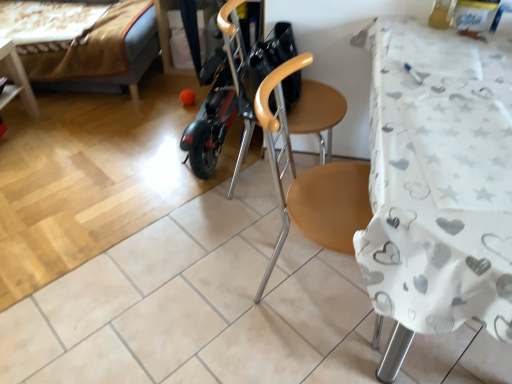
The height and width of the screenshot is (384, 512). What do you see at coordinates (310, 180) in the screenshot?
I see `wooden chair at center` at bounding box center [310, 180].

Locate an element on the screen. The image size is (512, 384). wooden swivel chair at center is located at coordinates (280, 83).

Find the location of a particular element. This screenshot has height=384, width=512. velvet brown bed at upper left is located at coordinates (102, 54).

In the scene shown: Does wooden chair at center have a greater width compared to wooden swivel chair at center?

Incorrect, the width of wooden chair at center does not surpass that of wooden swivel chair at center.

Is wooden chair at center inside or outside of wooden swivel chair at center?

wooden chair at center is not enclosed by wooden swivel chair at center.

Is point (287, 161) positioned after point (234, 71)?

No, (287, 161) is in front of (234, 71).

Considering the sizes of objects wooden chair at center and wooden swivel chair at center in the image provided, who is smaller, wooden chair at center or wooden swivel chair at center?

wooden swivel chair at center is smaller.

From a real-world perspective, who is located lower, velvet brown bed at upper left or white fabric-covered table at right?

velvet brown bed at upper left.

Does velvet brown bed at upper left come in front of white fabric-covered table at right?

No, it is not.

Are velvet brown bed at upper left and white fabric-covered table at right far apart?

Indeed, velvet brown bed at upper left is not near white fabric-covered table at right.

Which is further, (x=131, y=41) or (x=394, y=234)?

The point (x=131, y=41) is farther from the camera.

Which of these two, wooden swivel chair at center or wooden chair at center, is smaller?

wooden swivel chair at center is smaller.

Can you confirm if wooden swivel chair at center is wider than wooden chair at center?

Correct, the width of wooden swivel chair at center exceeds that of wooden chair at center.

From the image's perspective, between wooden swivel chair at center and wooden chair at center, which one is located above?

wooden swivel chair at center appears higher in the image.

Based on the photo, which object is positioned more to the left, wooden swivel chair at center or wooden chair at center?

From the viewer's perspective, wooden swivel chair at center appears more on the left side.

In the scene shown: Does velvet brown bed at upper left have a greater width compared to wooden swivel chair at center?

Yes, velvet brown bed at upper left is wider than wooden swivel chair at center.

Which is behind, velvet brown bed at upper left or wooden swivel chair at center?

velvet brown bed at upper left is further away from the camera.

Considering the relative sizes of velvet brown bed at upper left and wooden swivel chair at center in the image provided, is velvet brown bed at upper left taller than wooden swivel chair at center?

In fact, velvet brown bed at upper left may be shorter than wooden swivel chair at center.

Between white fabric-covered table at right and velvet brown bed at upper left, which one has smaller size?

Smaller between the two is white fabric-covered table at right.

Which is more to the left, white fabric-covered table at right or velvet brown bed at upper left?

From the viewer's perspective, velvet brown bed at upper left appears more on the left side.

This screenshot has width=512, height=384. I want to click on table below the velvet brown bed at upper left (from the image's perspective), so click(x=435, y=197).

From the image's perspective, does white fabric-covered table at right appear lower than velvet brown bed at upper left?

Indeed, from the image's perspective, white fabric-covered table at right is shown beneath velvet brown bed at upper left.

Are velvet brown bed at upper left and wooden chair at center making contact?

velvet brown bed at upper left and wooden chair at center are not in contact.

Considering the positions of objects velvet brown bed at upper left and wooden chair at center in the image provided, who is in front, velvet brown bed at upper left or wooden chair at center?

Positioned in front is wooden chair at center.

Considering the relative positions of velvet brown bed at upper left and wooden chair at center in the image provided, is velvet brown bed at upper left to the right of wooden chair at center from the viewer's perspective?

Incorrect, velvet brown bed at upper left is not on the right side of wooden chair at center.

Is point (90, 73) closer or farther from the camera than point (278, 253)?

Point (90, 73) is positioned farther from the camera compared to point (278, 253).

Would you consider wooden swivel chair at center to be distant from velvet brown bed at upper left?

wooden swivel chair at center is positioned a significant distance from velvet brown bed at upper left.

Which is farther, (278, 29) or (142, 9)?

The point (142, 9) is farther from the camera.

Is wooden swivel chair at center in front of velvet brown bed at upper left?

Yes.

From a real-world perspective, which is physically above, wooden swivel chair at center or velvet brown bed at upper left?

wooden swivel chair at center is physically above.

The width and height of the screenshot is (512, 384). Identify the location of chair that appears in front of the wooden swivel chair at center. (310, 180).

This screenshot has height=384, width=512. I want to click on bed beneath the white fabric-covered table at right (from a real-world perspective), so click(102, 54).

From the image, which object appears to be farther from wooden swivel chair at center, velvet brown bed at upper left or wooden chair at center?

Among the two, velvet brown bed at upper left is located further to wooden swivel chair at center.

Estimate the real-world distances between objects in this image. Which object is further from wooden chair at center, white fabric-covered table at right or velvet brown bed at upper left?

Based on the image, velvet brown bed at upper left appears to be further to wooden chair at center.

Looking at the image, which one is located further to white fabric-covered table at right, wooden swivel chair at center or velvet brown bed at upper left?

The object further to white fabric-covered table at right is velvet brown bed at upper left.

Estimate the real-world distances between objects in this image. Which object is closer to white fabric-covered table at right, wooden swivel chair at center or wooden chair at center?

wooden swivel chair at center is closer to white fabric-covered table at right.

From the image, which object appears to be farther from white fabric-covered table at right, velvet brown bed at upper left or wooden chair at center?

velvet brown bed at upper left lies further to white fabric-covered table at right than the other object.

When comparing their distances from velvet brown bed at upper left, does wooden swivel chair at center or wooden chair at center seem closer?

Among the two, wooden chair at center is located nearer to velvet brown bed at upper left.

Estimate the real-world distances between objects in this image. Which object is closer to velvet brown bed at upper left, white fabric-covered table at right or wooden chair at center?

wooden chair at center.

Consider the image. Looking at the image, which one is located closer to wooden swivel chair at center, wooden chair at center or white fabric-covered table at right?

wooden chair at center is closer to wooden swivel chair at center.

Find the location of a particular element. swivel chair located between velvet brown bed at upper left and wooden chair at center in the left-right direction is located at coordinates (280, 83).

At what (x,y) coordinates should I click in order to perform the action: click on swivel chair between velvet brown bed at upper left and white fabric-covered table at right. Please return your answer as a coordinate pair (x, y). The image size is (512, 384). Looking at the image, I should click on (280, 83).

Find the location of a particular element. The width and height of the screenshot is (512, 384). chair between white fabric-covered table at right and wooden swivel chair at center in the front-back direction is located at coordinates (310, 180).

What are the coordinates of `chair situated between velvet brown bed at upper left and white fabric-covered table at right from left to right` in the screenshot? It's located at (310, 180).